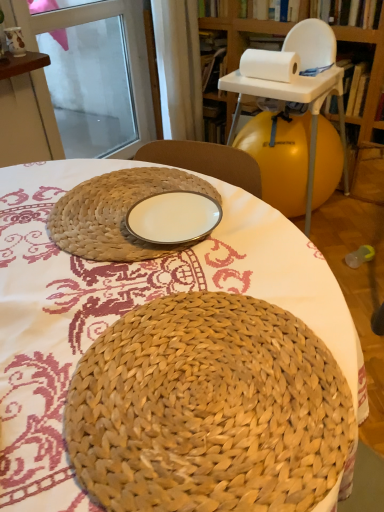
Question: Can you confirm if white fabric curtain at upper center is bigger than wooden bookshelf at upper right?

Choices:
 (A) no
 (B) yes

Answer: (A)

Question: Does white fabric curtain at upper center have a lesser height compared to wooden bookshelf at upper right?

Choices:
 (A) yes
 (B) no

Answer: (A)

Question: Is white fabric curtain at upper center behind wooden bookshelf at upper right?

Choices:
 (A) yes
 (B) no

Answer: (A)

Question: Is white fabric curtain at upper center with wooden bookshelf at upper right?

Choices:
 (A) yes
 (B) no

Answer: (B)

Question: From a real-world perspective, is white fabric curtain at upper center on top of wooden bookshelf at upper right?

Choices:
 (A) yes
 (B) no

Answer: (A)

Question: Is white glossy plate at center bigger or smaller than white paper at upper right?

Choices:
 (A) small
 (B) big

Answer: (A)

Question: Does point (190, 202) appear closer or farther from the camera than point (258, 56)?

Choices:
 (A) closer
 (B) farther

Answer: (A)

Question: Is white glossy plate at center inside the boundaries of white paper at upper right, or outside?

Choices:
 (A) outside
 (B) inside

Answer: (A)

Question: From the image's perspective, relative to white paper at upper right, is white glossy plate at center above or below?

Choices:
 (A) below
 (B) above

Answer: (A)

Question: Is white paper at upper right spatially inside white fabric curtain at upper center, or outside of it?

Choices:
 (A) inside
 (B) outside

Answer: (B)

Question: Is white paper at upper right in front of or behind white fabric curtain at upper center in the image?

Choices:
 (A) behind
 (B) front

Answer: (B)

Question: Is point (248, 56) closer or farther from the camera than point (188, 42)?

Choices:
 (A) farther
 (B) closer

Answer: (B)

Question: In terms of width, does white paper at upper right look wider or thinner when compared to white fabric curtain at upper center?

Choices:
 (A) wide
 (B) thin

Answer: (B)

Question: In terms of height, does white fabric curtain at upper center look taller or shorter compared to white glossy plate at center?

Choices:
 (A) short
 (B) tall

Answer: (B)

Question: Is white fabric curtain at upper center wider or thinner than white glossy plate at center?

Choices:
 (A) wide
 (B) thin

Answer: (A)